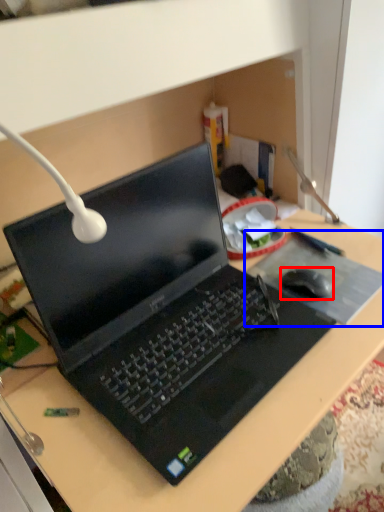
Question: Which point is further to the camera, mouse (highlighted by a red box) or mousepad (highlighted by a blue box)?

Choices:
 (A) mouse
 (B) mousepad

Answer: (A)